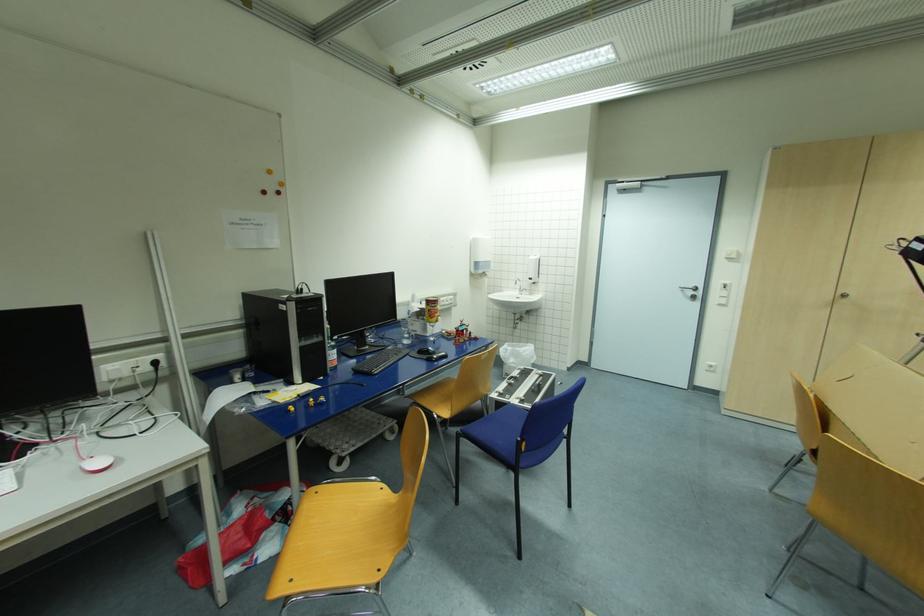
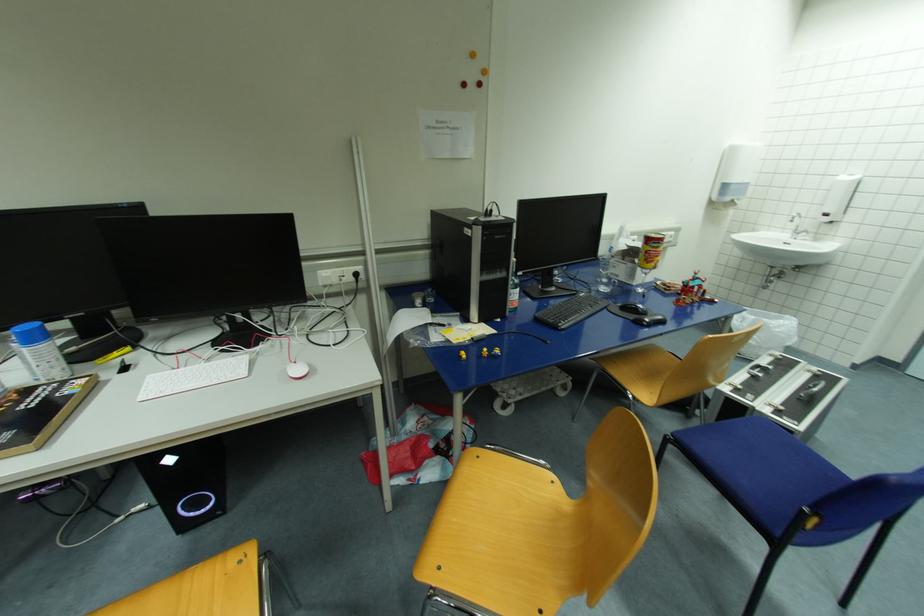
Locate, in the second image, the point that corresponds to the point at 102,464 in the first image.

(301, 371)